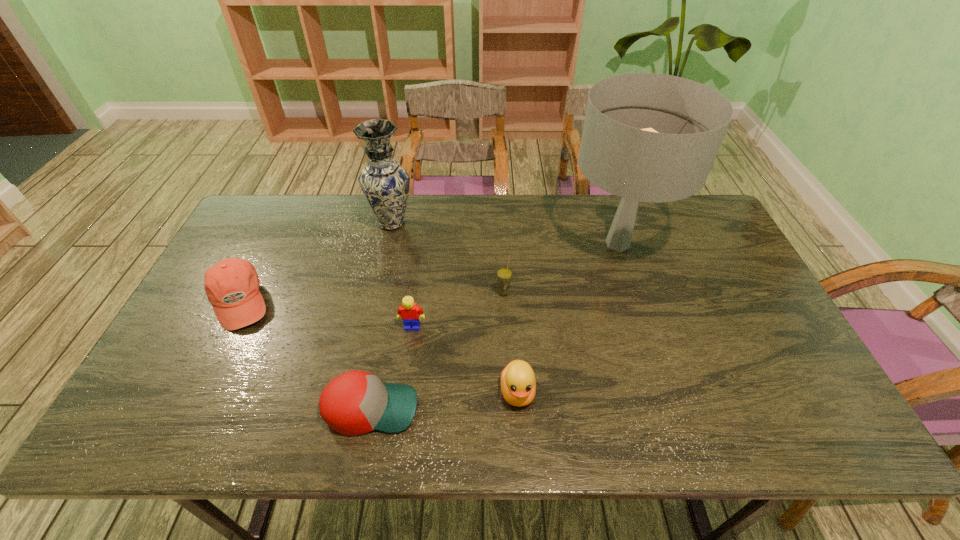
I want to click on object that is at the left edge, so click(232, 285).

Find the location of a particular element. This screenshot has width=960, height=540. free region at the far edge is located at coordinates (466, 221).

In the image, there is a desktop. Identify the location of vacant space at the near edge. This screenshot has height=540, width=960. (494, 409).

At what (x,y) coordinates should I click in order to perform the action: click on free spot at the right edge of the desktop. Please return your answer as a coordinate pair (x, y). The width and height of the screenshot is (960, 540). Looking at the image, I should click on (x=783, y=370).

Locate an element on the screen. free point at the far left corner is located at coordinates (272, 200).

At what (x,y) coordinates should I click in order to perform the action: click on free space at the far right corner. Please return your answer as a coordinate pair (x, y). This screenshot has width=960, height=540. Looking at the image, I should click on (700, 231).

In order to click on unoccupied area between the duckling and the Lego in this screenshot , I will do `click(465, 359)`.

Locate an element on the screen. free space that is in between the straw for drinking and the tallest object is located at coordinates (561, 268).

Where is `empty location between the lampshade and the second tallest object`? The image size is (960, 540). empty location between the lampshade and the second tallest object is located at coordinates (505, 234).

Find the location of `unoccupied area between the rightmost object and the duckling`. unoccupied area between the rightmost object and the duckling is located at coordinates (567, 318).